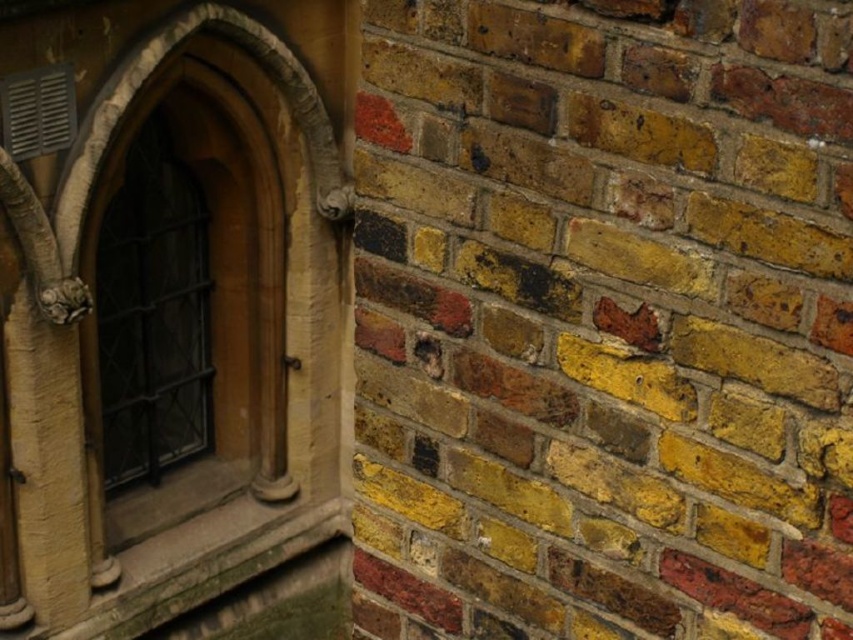
You are an architect examining the building exterior. You need to determine the spatial relationship between the yellow brick wall at center and the dark brown wooden window at left. Which object is positioned lower in the image?

The yellow brick wall at center is positioned below the dark brown wooden window at left, so it is lower in the image.

You are an architect reviewing a building design. You notice the yellow brick wall at center and the dark brown wooden window at left. Which structure has a greater height in the image?

The dark brown wooden window at left is taller than the yellow brick wall at center.

You are an architect assessing the exterior of a building. You need to determine which object occupies more horizontal space in the image between the yellow brick wall at center and the dark brown wooden window at left. Which one is wider?

The yellow brick wall at center is wider than the dark brown wooden window at left according to the description.